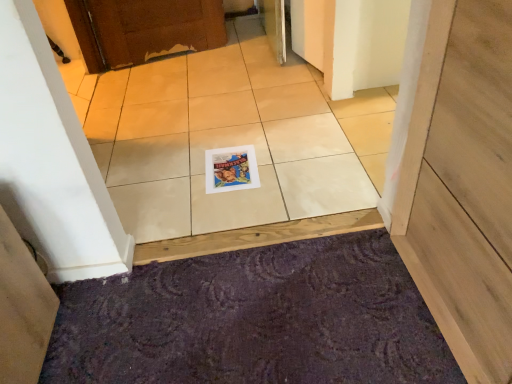
The width and height of the screenshot is (512, 384). In order to click on vacant area in front of matte paper magazine at center in this screenshot , I will do `click(234, 207)`.